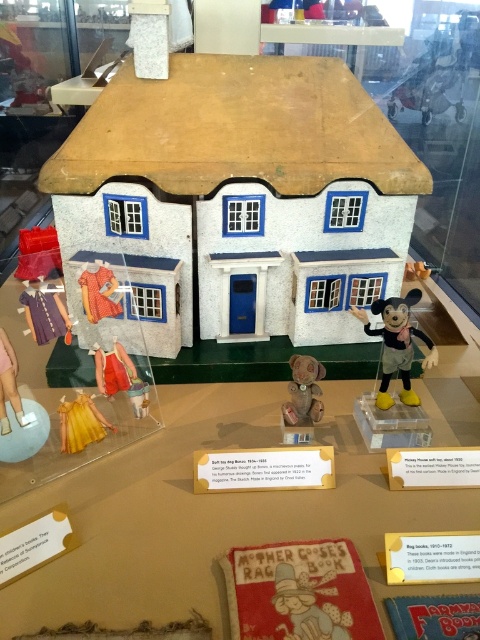
Can you confirm if matte red dress at lower left is wider than yellow satin dress at lower left?

Yes, matte red dress at lower left is wider than yellow satin dress at lower left.

Does matte red dress at lower left have a larger size compared to yellow satin dress at lower left?

Yes.

Is point (137, 392) positioned behind point (106, 426)?

Yes, it is.

Locate an element on the screen. This screenshot has width=480, height=640. matte red dress at lower left is located at coordinates (120, 378).

Between matte plastic mickey mouse at right and yellow satin dress at lower left, which one is positioned lower?

yellow satin dress at lower left is below.

Can you confirm if matte plastic mickey mouse at right is positioned below yellow satin dress at lower left?

Incorrect, matte plastic mickey mouse at right is not positioned below yellow satin dress at lower left.

Describe the element at coordinates (396, 344) in the screenshot. The height and width of the screenshot is (640, 480). I see `matte plastic mickey mouse at right` at that location.

In order to click on matte plastic mickey mouse at right in this screenshot , I will do `click(396, 344)`.

At what (x,y) coordinates should I click in order to perform the action: click on matte plastic mickey mouse at right. Please return your answer as a coordinate pair (x, y). Image resolution: width=480 pixels, height=640 pixels. Looking at the image, I should click on pos(396,344).

Is matte plastic mickey mouse at right bigger than matte red dress at lower left?

Yes, matte plastic mickey mouse at right is bigger than matte red dress at lower left.

You are a GUI agent. You are given a task and a screenshot of the screen. Output one action in this format:
    pyautogui.click(x=<x>, y=<y>)
    Task: Click on the matte plastic mickey mouse at right
    This screenshot has height=640, width=480.
    Given the screenshot: What is the action you would take?
    pyautogui.click(x=396, y=344)